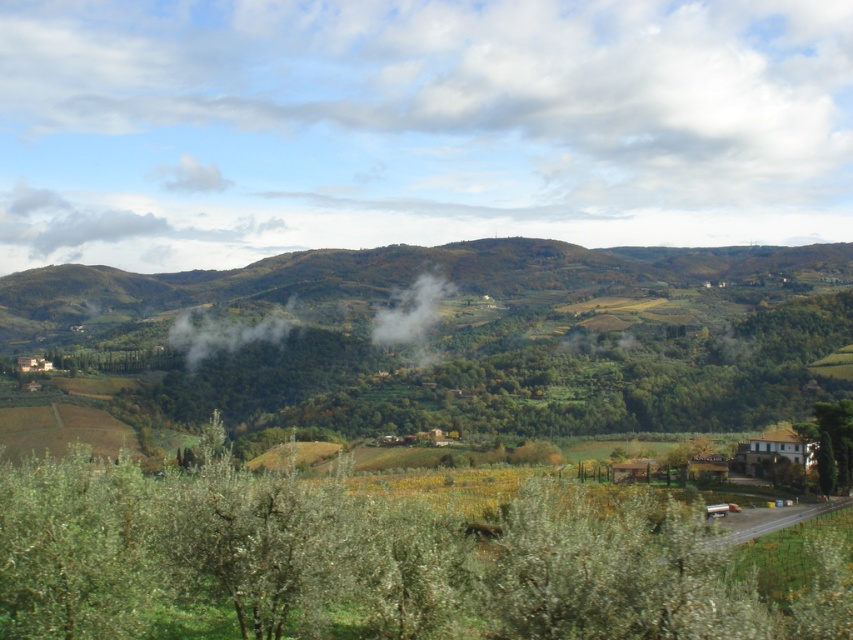
Which is in front, point (102, 509) or point (833, 444)?

Point (102, 509)

Who is lower down, green leafy tree at lower left or green leafy tree at lower right?

green leafy tree at lower right is lower down.

At what (x,y) coordinates should I click in order to perform the action: click on green leafy tree at lower left. Please return your answer as a coordinate pair (x, y). Looking at the image, I should click on (366, 561).

Where is `green leafy tree at lower left`? green leafy tree at lower left is located at coordinates (366, 561).

Can you confirm if green leafy tree at lower left is smaller than green leafy forest at center?

Indeed, green leafy tree at lower left has a smaller size compared to green leafy forest at center.

Which is behind, point (132, 550) or point (3, 339)?

Positioned behind is point (3, 339).

At what (x,y) coordinates should I click in order to perform the action: click on green leafy tree at lower left. Please return your answer as a coordinate pair (x, y). The height and width of the screenshot is (640, 853). Looking at the image, I should click on (366, 561).

This screenshot has height=640, width=853. Identify the location of green leafy tree at lower left. (366, 561).

Between green leafy forest at center and green leafy tree at lower right, which one appears on the right side from the viewer's perspective?

From the viewer's perspective, green leafy tree at lower right appears more on the right side.

Does green leafy forest at center have a larger size compared to green leafy tree at lower right?

Correct, green leafy forest at center is larger in size than green leafy tree at lower right.

Which is behind, point (123, 332) or point (830, 456)?

Point (123, 332)

Identify the location of green leafy forest at center. (405, 282).